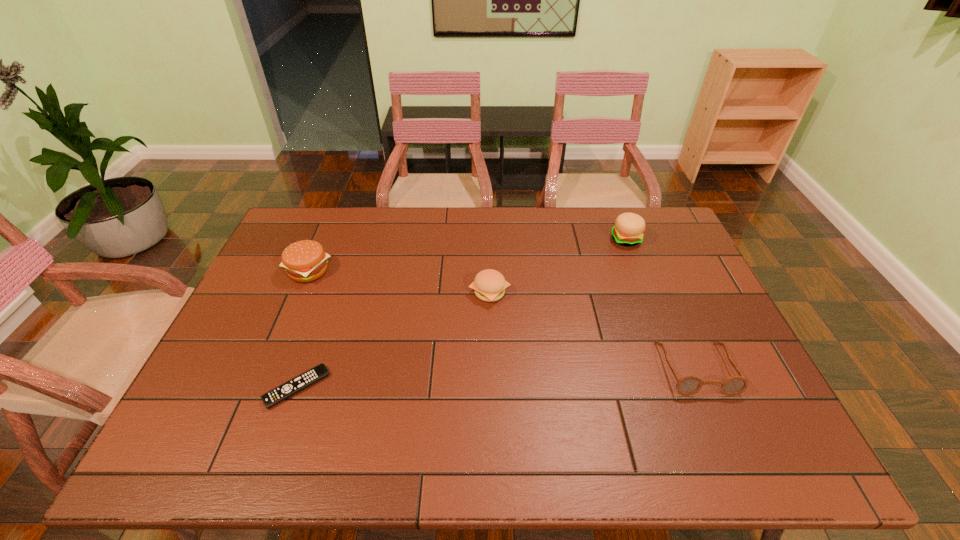
I want to click on the farthest hamburger, so click(x=628, y=230).

The height and width of the screenshot is (540, 960). Identify the location of the farthest object. (628, 230).

At what (x,y) coordinates should I click in order to perform the action: click on the leftmost hamburger. Please return your answer as a coordinate pair (x, y). Looking at the image, I should click on (305, 260).

At what (x,y) coordinates should I click in order to perform the action: click on the third object from right to left. Please return your answer as a coordinate pair (x, y). The height and width of the screenshot is (540, 960). Looking at the image, I should click on (489, 285).

Locate an element on the screen. The height and width of the screenshot is (540, 960). the second shortest object is located at coordinates (690, 385).

The height and width of the screenshot is (540, 960). In order to click on the shortest object in this screenshot , I will do click(304, 380).

In order to click on vacant space located 0.090m on the right of the rightmost hamburger in this screenshot , I will do pos(667,239).

Where is `vacant region located on the front of the leftmost hamburger`? The width and height of the screenshot is (960, 540). vacant region located on the front of the leftmost hamburger is located at coordinates (290, 316).

The height and width of the screenshot is (540, 960). Identify the location of free space located 0.100m on the front of the third object from left to right. (491, 335).

Locate an element on the screen. The image size is (960, 540). blank space located 0.110m on the front-facing side of the second shortest object is located at coordinates (727, 440).